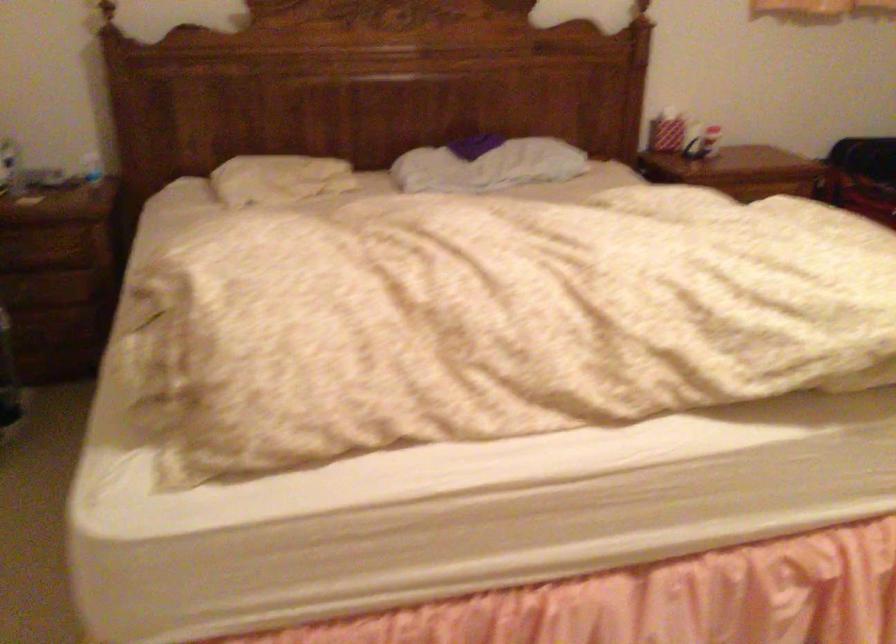
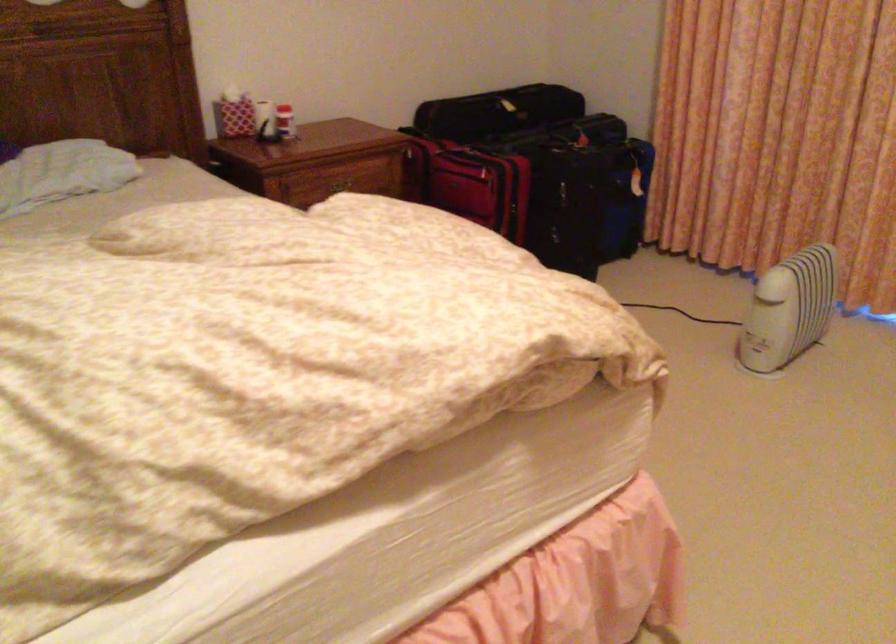
Where in the second image is the point corresponding to (x=753, y=192) from the first image?

(338, 185)